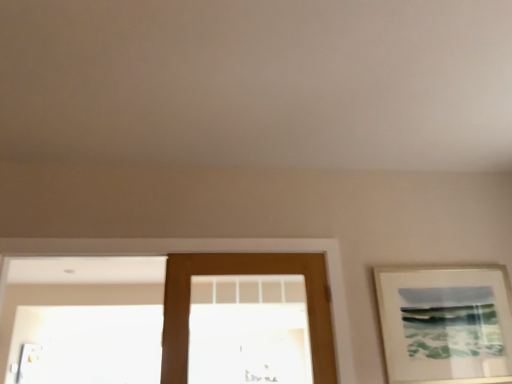
Question: Is brown wooden door at center outside of matte white picture frame at right?

Choices:
 (A) yes
 (B) no

Answer: (A)

Question: Are brown wooden door at center and matte white picture frame at right located far from each other?

Choices:
 (A) no
 (B) yes

Answer: (A)

Question: Is brown wooden door at center further to the viewer compared to matte white picture frame at right?

Choices:
 (A) no
 (B) yes

Answer: (A)

Question: Can you confirm if brown wooden door at center is positioned to the left of matte white picture frame at right?

Choices:
 (A) yes
 (B) no

Answer: (A)

Question: Is brown wooden door at center smaller than matte white picture frame at right?

Choices:
 (A) no
 (B) yes

Answer: (A)

Question: Considering the relative sizes of brown wooden door at center and matte white picture frame at right in the image provided, is brown wooden door at center wider than matte white picture frame at right?

Choices:
 (A) yes
 (B) no

Answer: (A)

Question: From the image's perspective, does matte white picture frame at right appear higher than brown wooden door at center?

Choices:
 (A) yes
 (B) no

Answer: (B)

Question: Can you confirm if matte white picture frame at right is taller than brown wooden door at center?

Choices:
 (A) yes
 (B) no

Answer: (B)

Question: Is matte white picture frame at right facing towards brown wooden door at center?

Choices:
 (A) yes
 (B) no

Answer: (B)

Question: Considering the relative positions of matte white picture frame at right and brown wooden door at center in the image provided, is matte white picture frame at right to the right of brown wooden door at center from the viewer's perspective?

Choices:
 (A) no
 (B) yes

Answer: (B)

Question: From a real-world perspective, is matte white picture frame at right on brown wooden door at center?

Choices:
 (A) no
 (B) yes

Answer: (A)

Question: Can you confirm if matte white picture frame at right is thinner than brown wooden door at center?

Choices:
 (A) no
 (B) yes

Answer: (B)

Question: Could you tell me if brown wooden door at center is facing brown wooden door at center?

Choices:
 (A) yes
 (B) no

Answer: (A)